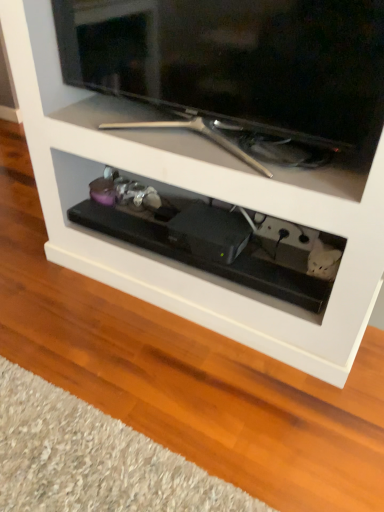
Where is `matte black television at upper center`? matte black television at upper center is located at coordinates (240, 67).

The width and height of the screenshot is (384, 512). What do you see at coordinates (240, 67) in the screenshot?
I see `matte black television at upper center` at bounding box center [240, 67].

In order to face matte black television at upper center, should I rotate leftwards or rightwards?

To face it directly, rotate left by 0.412 degrees.

Describe the element at coordinates (202, 245) in the screenshot. I see `black plastic drawer at center` at that location.

The image size is (384, 512). I want to click on black plastic drawer at center, so click(202, 245).

This screenshot has width=384, height=512. In order to click on matte black television at upper center in this screenshot , I will do `click(240, 67)`.

Which object is positioned more to the left, black plastic drawer at center or matte black television at upper center?

black plastic drawer at center is more to the left.

Is black plastic drawer at center closer to the viewer compared to matte black television at upper center?

No, the depth of black plastic drawer at center is greater than that of matte black television at upper center.

Which point is more forward, (288, 284) or (149, 25)?

The point (149, 25) is in front.

From the image's perspective, is black plastic drawer at center located above matte black television at upper center?

Actually, black plastic drawer at center appears below matte black television at upper center in the image.

From a real-world perspective, is black plastic drawer at center located higher than matte black television at upper center?

No.

From the picture: Is black plastic drawer at center wider than matte black television at upper center?

Yes, black plastic drawer at center is wider than matte black television at upper center.

From the picture: Who is shorter, black plastic drawer at center or matte black television at upper center?

black plastic drawer at center.

Looking at this image, looking at the image, does black plastic drawer at center seem bigger or smaller compared to matte black television at upper center?

In the image, black plastic drawer at center appears to be smaller than matte black television at upper center.

Would you say matte black television at upper center is part of black plastic drawer at center's contents?

Definitely not — matte black television at upper center is not inside black plastic drawer at center.

Are black plastic drawer at center and matte black television at upper center beside each other?

black plastic drawer at center is not next to matte black television at upper center, and they're not touching.

Is matte black television at upper center at the back of black plastic drawer at center?

No, matte black television at upper center is not at the back of black plastic drawer at center.

Locate an element on the screen. This screenshot has height=512, width=384. drawer on the left of matte black television at upper center is located at coordinates (202, 245).

Does matte black television at upper center appear on the left side of black plastic drawer at center?

In fact, matte black television at upper center is to the right of black plastic drawer at center.

Which object is further away from the camera, matte black television at upper center or black plastic drawer at center?

black plastic drawer at center is further away from the camera.

Considering the positions of points (251, 88) and (314, 237), is point (251, 88) farther from camera compared to point (314, 237)?

No.

From the image's perspective, which is above, matte black television at upper center or black plastic drawer at center?

matte black television at upper center is shown above in the image.

From a real-world perspective, is matte black television at upper center over black plastic drawer at center?

Yes, from a real-world perspective, matte black television at upper center is over black plastic drawer at center

Between matte black television at upper center and black plastic drawer at center, which one has larger width?

black plastic drawer at center is wider.

Considering the sizes of objects matte black television at upper center and black plastic drawer at center in the image provided, who is taller, matte black television at upper center or black plastic drawer at center?

Standing taller between the two is matte black television at upper center.

Between matte black television at upper center and black plastic drawer at center, which one has larger size?

matte black television at upper center.

Is matte black television at upper center outside of black plastic drawer at center?

Absolutely, matte black television at upper center is external to black plastic drawer at center.

Is matte black television at upper center not close to black plastic drawer at center?

They are positioned close to each other.

Is matte black television at upper center oriented away from black plastic drawer at center?

No, matte black television at upper center's orientation is not away from black plastic drawer at center.

Identify the location of television located in front of the black plastic drawer at center. The image size is (384, 512). (240, 67).

This screenshot has height=512, width=384. I want to click on drawer that is under the matte black television at upper center (from a real-world perspective), so click(x=202, y=245).

In order to click on television that appears on the right of black plastic drawer at center in this screenshot , I will do pos(240,67).